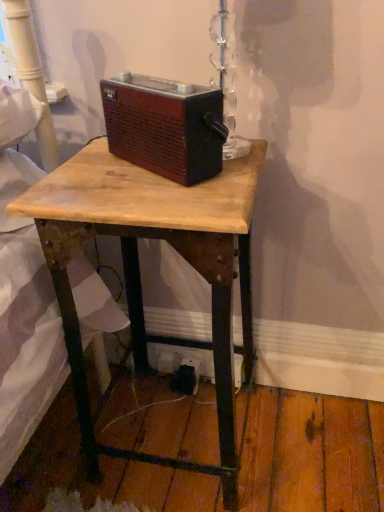
This screenshot has height=512, width=384. What are the coordinates of `free space in front of brown wood radio at center` in the screenshot? It's located at (163, 190).